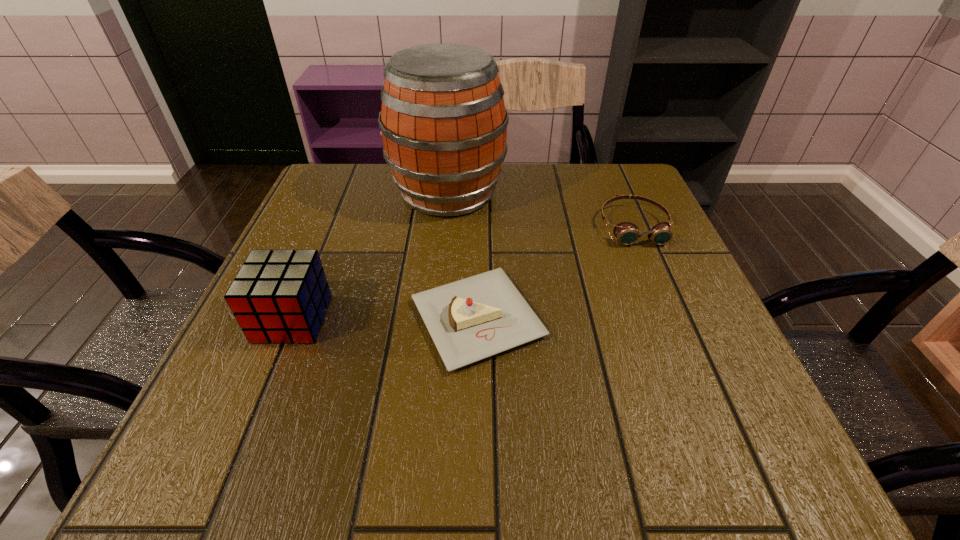
Identify which object is located as the third nearest to the goggles. Please provide its 2D coordinates. Your answer should be formatted as a tuple, i.e. [(x, y)], where the tuple contains the x and y coordinates of a point satisfying the conditions above.

[(278, 296)]

Identify which object is the third nearest to the cider. Please provide its 2D coordinates. Your answer should be formatted as a tuple, i.e. [(x, y)], where the tuple contains the x and y coordinates of a point satisfying the conditions above.

[(278, 296)]

Where is `free point that satisfies the following two spatial constraints: 1. on the back side of the tallest object; 2. on the left side of the leftmost object`? free point that satisfies the following two spatial constraints: 1. on the back side of the tallest object; 2. on the left side of the leftmost object is located at coordinates (345, 193).